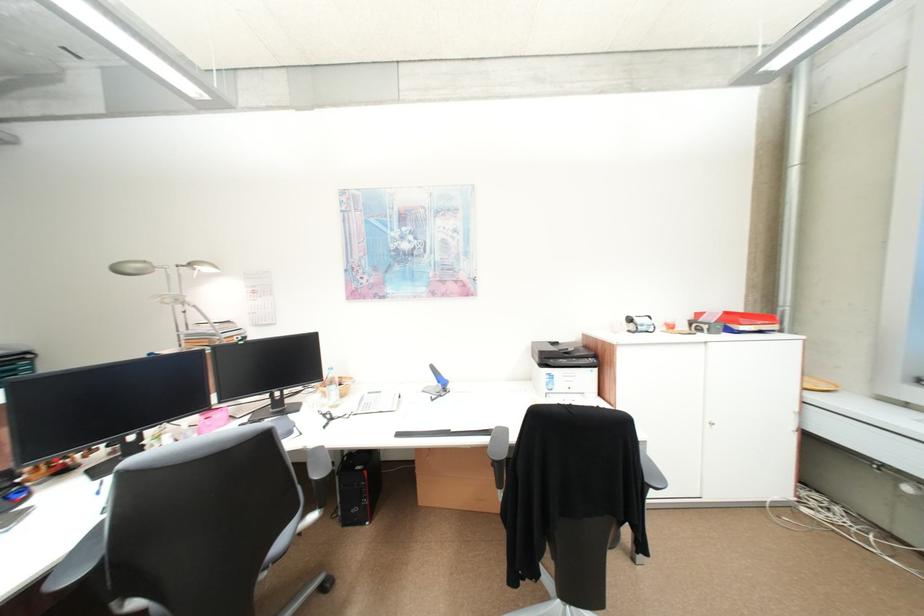
This screenshot has width=924, height=616. I want to click on white telephone handset, so click(383, 402).